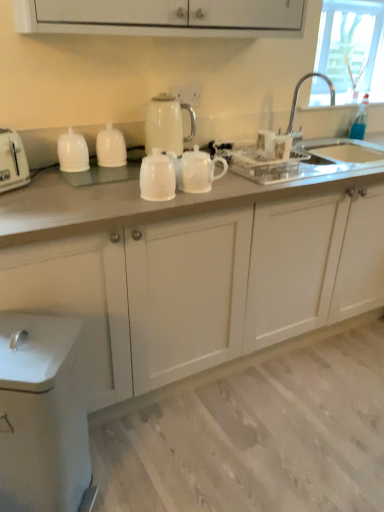
Identify the location of vacant space to the right of white glossy teapot at center. (251, 193).